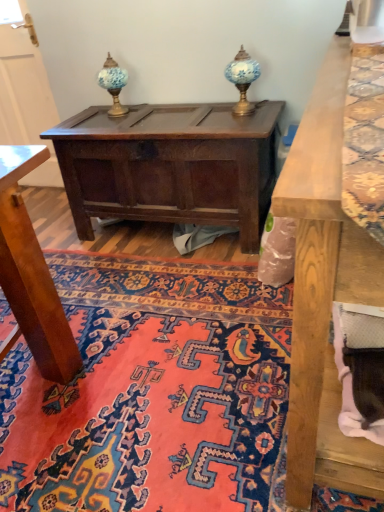
You are a GUI agent. You are given a task and a screenshot of the screen. Output one action in this format:
    pyautogui.click(x=<x>, y=<y>)
    Task: Click on the vacant area on top of carpet with intricate patterns at center (from a real-world perspective)
    
    Given the screenshot: What is the action you would take?
    pyautogui.click(x=195, y=328)